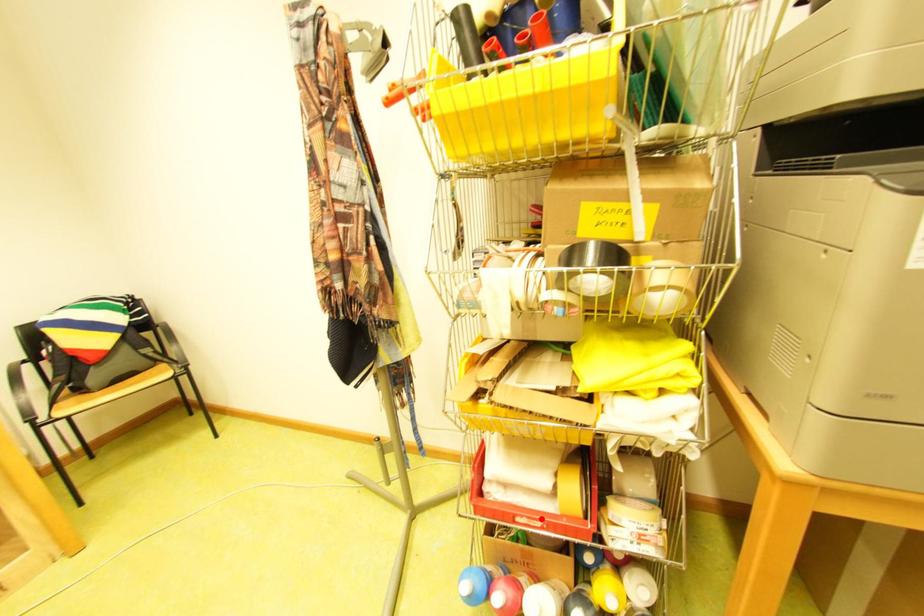
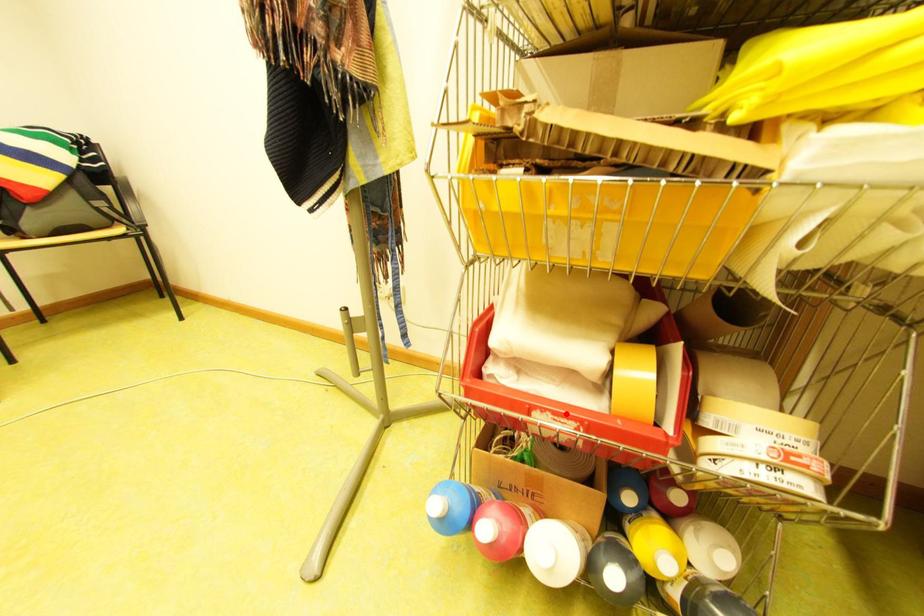
I am providing you with two images of the same scene from different viewpoints. A red point is marked on the first image and another point is marked on the second image. Do the highlighted points in image1 and image2 indicate the same real-world spot?

Yes